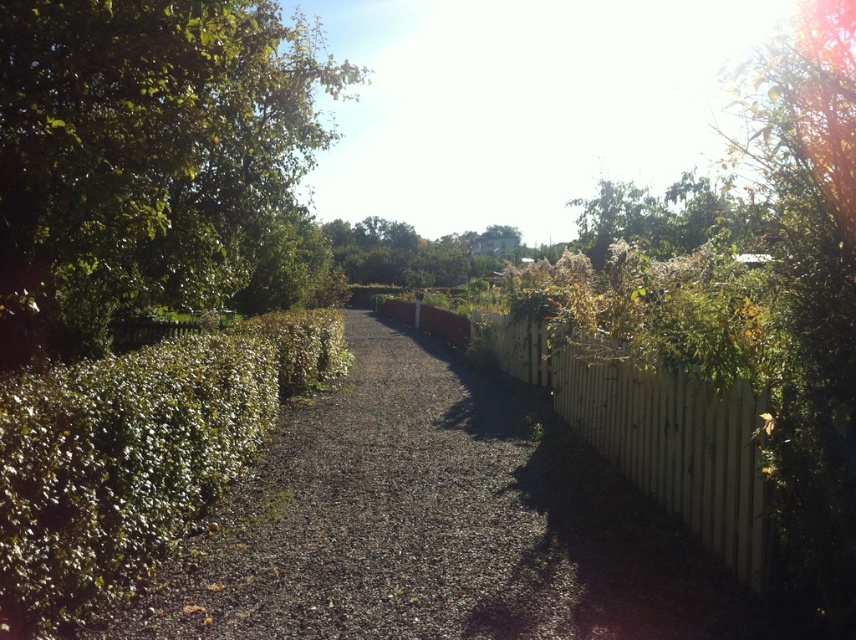
You are a gardener who needs to mow the lawn. You see the dark gray gravel at center and the green leafy bush at left. Which object is taller?

The green leafy bush at left is taller than the dark gray gravel at center.